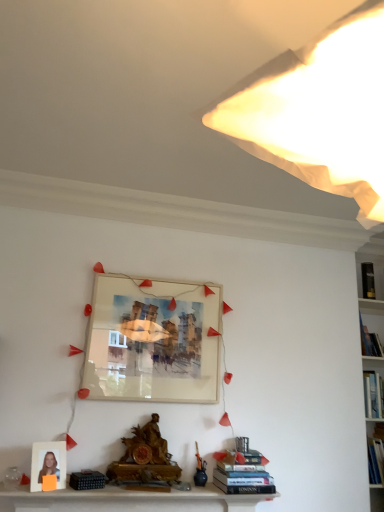
Measure the distance between hardcover books at lower center, the first book from the left, and camera.

7.85 feet.

This screenshot has height=512, width=384. What are the coordinates of `white paper lampshade at upper right` in the screenshot? It's located at (321, 114).

In the scene shown: What is the approximate width of white matte photo frame at lower left, the first picture frame viewed from the front?

2.17 inches.

Locate an element on the screen. blue hardcover book at upper right, which appears as the second book when viewed from the back is located at coordinates (370, 341).

This screenshot has height=512, width=384. Find the location of `hardcover books at lower center, the first book from the left`. hardcover books at lower center, the first book from the left is located at coordinates (242, 471).

Can you confirm if hardcover books at lower center, positioned as the 1th book in front-to-back order, is thinner than matte glass picture frame at center, the 2th picture frame from the left?

No, hardcover books at lower center, positioned as the 1th book in front-to-back order, is not thinner than matte glass picture frame at center, the 2th picture frame from the left.

Considering the sizes of objects hardcover books at lower center, the first book from the left, and matte glass picture frame at center, which is the second picture frame from bottom to top, in the image provided, who is smaller, hardcover books at lower center, the first book from the left, or matte glass picture frame at center, which is the second picture frame from bottom to top,?

hardcover books at lower center, the first book from the left, is smaller.

From the image's perspective, which is above, hardcover books at lower center, the 3th book when ordered from top to bottom, or matte glass picture frame at center, which is the second picture frame from bottom to top?

matte glass picture frame at center, which is the second picture frame from bottom to top, from the image's perspective.

Which of these two, black hardcover book at upper right, marked as the first book in a top-to-bottom arrangement, or matte glass picture frame at center, positioned as the 1th picture frame in right-to-left order, is bigger?

matte glass picture frame at center, positioned as the 1th picture frame in right-to-left order.

Is black hardcover book at upper right, acting as the 3th book starting from the bottom, not close to matte glass picture frame at center, which is the second picture frame from bottom to top?

Yes, black hardcover book at upper right, acting as the 3th book starting from the bottom, and matte glass picture frame at center, which is the second picture frame from bottom to top, are quite far apart.

From the image's perspective, between black hardcover book at upper right, acting as the 3th book starting from the bottom, and matte glass picture frame at center, the 1th picture frame positioned from the top, who is located below?

matte glass picture frame at center, the 1th picture frame positioned from the top.

Considering the sizes of objects hardcover books at lower center, the first book positioned from the bottom, and white paper lampshade at upper right in the image provided, who is taller, hardcover books at lower center, the first book positioned from the bottom, or white paper lampshade at upper right?

Standing taller between the two is white paper lampshade at upper right.

Who is smaller, hardcover books at lower center, the first book positioned from the bottom, or white paper lampshade at upper right?

hardcover books at lower center, the first book positioned from the bottom, is smaller.

In the scene shown: Is hardcover books at lower center, the 3th book when ordered from top to bottom, in front of or behind white paper lampshade at upper right in the image?

hardcover books at lower center, the 3th book when ordered from top to bottom, is positioned farther from the viewer than white paper lampshade at upper right.

Find the location of a particular element. Image resolution: width=384 pixels, height=512 pixels. light that is in front of the hardcover books at lower center, positioned as the 1th book in front-to-back order is located at coordinates (321, 114).

Is matte glass picture frame at center, the first picture frame viewed from the back, far from blue hardcover book at upper right, placed as the second book when sorted from right to left?

matte glass picture frame at center, the first picture frame viewed from the back, is far away from blue hardcover book at upper right, placed as the second book when sorted from right to left.

From a real-world perspective, is matte glass picture frame at center, which appears as the 2th picture frame when viewed from the front, beneath blue hardcover book at upper right, the second book when ordered from top to bottom?

Yes, from a real-world perspective, matte glass picture frame at center, which appears as the 2th picture frame when viewed from the front, is beneath blue hardcover book at upper right, the second book when ordered from top to bottom.

From the image's perspective, which object appears higher, matte glass picture frame at center, which is the second picture frame from bottom to top, or blue hardcover book at upper right, which appears as the second book when viewed from the front?

matte glass picture frame at center, which is the second picture frame from bottom to top, appears higher in the image.

Choose the correct answer: Is black hardcover book at upper right, the third book viewed from the front, inside white paper lampshade at upper right or outside it?

black hardcover book at upper right, the third book viewed from the front, cannot be found inside white paper lampshade at upper right.

From the image's perspective, relative to white paper lampshade at upper right, is black hardcover book at upper right, acting as the 3th book starting from the bottom, above or below?

Based on their image positions, black hardcover book at upper right, acting as the 3th book starting from the bottom, is located beneath white paper lampshade at upper right.

Is black hardcover book at upper right, the third book viewed from the front, aimed at white paper lampshade at upper right?

No, black hardcover book at upper right, the third book viewed from the front, is not facing towards white paper lampshade at upper right.

From a real-world perspective, who is located higher, matte glass picture frame at center, which appears as the 2th picture frame when viewed from the front, or black hardcover book at upper right, positioned as the first book in back-to-front order?

black hardcover book at upper right, positioned as the first book in back-to-front order, from a real-world perspective.

Is black hardcover book at upper right, the third book viewed from the front, at the back of matte glass picture frame at center, the first picture frame viewed from the back?

matte glass picture frame at center, the first picture frame viewed from the back, is not turned away from black hardcover book at upper right, the third book viewed from the front.

From the image's perspective, would you say matte glass picture frame at center, which is the second picture frame from bottom to top, is positioned over black hardcover book at upper right, marked as the first book in a top-to-bottom arrangement?

Actually, matte glass picture frame at center, which is the second picture frame from bottom to top, appears below black hardcover book at upper right, marked as the first book in a top-to-bottom arrangement, in the image.

How much distance is there between matte glass picture frame at center, the 2th picture frame from the left, and black hardcover book at upper right, the third book in the left-to-right sequence?

They are 5.22 feet apart.

Which picture frame is the 1st one when counting from the front of the blue hardcover book at upper right, placed as the second book when sorted from right to left? Please provide its 2D coordinates.

[(153, 341)]

Considering the points (379, 355) and (212, 342), which point is behind, point (379, 355) or point (212, 342)?

The point (379, 355) is farther.

From a real-world perspective, is blue hardcover book at upper right, arranged as the 2th book when viewed from the left, located beneath matte glass picture frame at center, the 1th picture frame positioned from the top?

No.

The width and height of the screenshot is (384, 512). Identify the location of book in front of the matte glass picture frame at center, which is the second picture frame from bottom to top. (242, 471).

From the image's perspective, which picture frame is the 1st one below the black hardcover book at upper right, the third book viewed from the front? Please provide its 2D coordinates.

[(153, 341)]

Considering their positions, is black hardcover book at upper right, positioned as the first book in back-to-front order, positioned further to white matte photo frame at lower left, the second picture frame in the top-to-bottom sequence, than matte glass picture frame at center, the 1th picture frame positioned from the top?

The object further to white matte photo frame at lower left, the second picture frame in the top-to-bottom sequence, is black hardcover book at upper right, positioned as the first book in back-to-front order.

Based on their spatial positions, is hardcover books at lower center, positioned as the 1th book in front-to-back order, or black hardcover book at upper right, positioned as the first book in back-to-front order, closer to blue hardcover book at upper right, arranged as the second book when ordered from the bottom?

Among the two, black hardcover book at upper right, positioned as the first book in back-to-front order, is located nearer to blue hardcover book at upper right, arranged as the second book when ordered from the bottom.

Looking at the image, which one is located further to white matte photo frame at lower left, the second picture frame in the top-to-bottom sequence, matte glass picture frame at center, which is the second picture frame from bottom to top, or hardcover books at lower center, the third book in the right-to-left sequence?

Among the two, hardcover books at lower center, the third book in the right-to-left sequence, is located further to white matte photo frame at lower left, the second picture frame in the top-to-bottom sequence.

Which object lies further to the anchor point black hardcover book at upper right, the third book viewed from the front, white paper lampshade at upper right or white matte photo frame at lower left, marked as the 2th picture frame in a back-to-front arrangement?

white paper lampshade at upper right is further to black hardcover book at upper right, the third book viewed from the front.

Considering their positions, is blue hardcover book at upper right, arranged as the second book when ordered from the bottom, positioned closer to matte glass picture frame at center, the first picture frame viewed from the back, than white paper lampshade at upper right?

blue hardcover book at upper right, arranged as the second book when ordered from the bottom.

Considering their positions, is matte glass picture frame at center, the 2th picture frame from the left, positioned further to white matte photo frame at lower left, the 2th picture frame when ordered from right to left, than black hardcover book at upper right, marked as the first book in a top-to-bottom arrangement?

Based on the image, black hardcover book at upper right, marked as the first book in a top-to-bottom arrangement, appears to be further to white matte photo frame at lower left, the 2th picture frame when ordered from right to left.

Looking at the image, which one is located closer to white paper lampshade at upper right, black hardcover book at upper right, acting as the 3th book starting from the bottom, or matte glass picture frame at center, positioned as the 1th picture frame in right-to-left order?

The object closer to white paper lampshade at upper right is matte glass picture frame at center, positioned as the 1th picture frame in right-to-left order.

Based on their spatial positions, is hardcover books at lower center, the first book from the left, or white matte photo frame at lower left, marked as the first picture frame in a bottom-to-top arrangement, closer to white paper lampshade at upper right?

hardcover books at lower center, the first book from the left, lies closer to white paper lampshade at upper right than the other object.

The height and width of the screenshot is (512, 384). What are the coordinates of `book between white paper lampshade at upper right and blue hardcover book at upper right, which appears as the second book when viewed from the back, along the z-axis` in the screenshot? It's located at (242, 471).

The width and height of the screenshot is (384, 512). Find the location of `book between white paper lampshade at upper right and matte glass picture frame at center, the 1th picture frame positioned from the top, in the front-back direction`. book between white paper lampshade at upper right and matte glass picture frame at center, the 1th picture frame positioned from the top, in the front-back direction is located at coordinates (242, 471).

Identify the location of picture frame between white paper lampshade at upper right and matte glass picture frame at center, which appears as the 2th picture frame when viewed from the front, in the front-back direction. (48, 463).

Identify the location of picture frame positioned between white paper lampshade at upper right and hardcover books at lower center, the third book in the right-to-left sequence, from near to far. This screenshot has height=512, width=384. (48, 463).